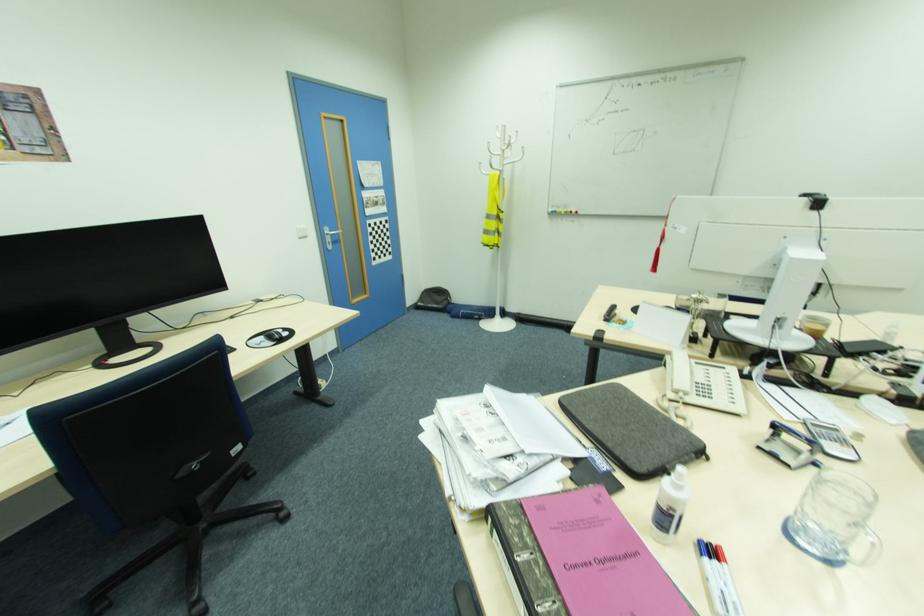
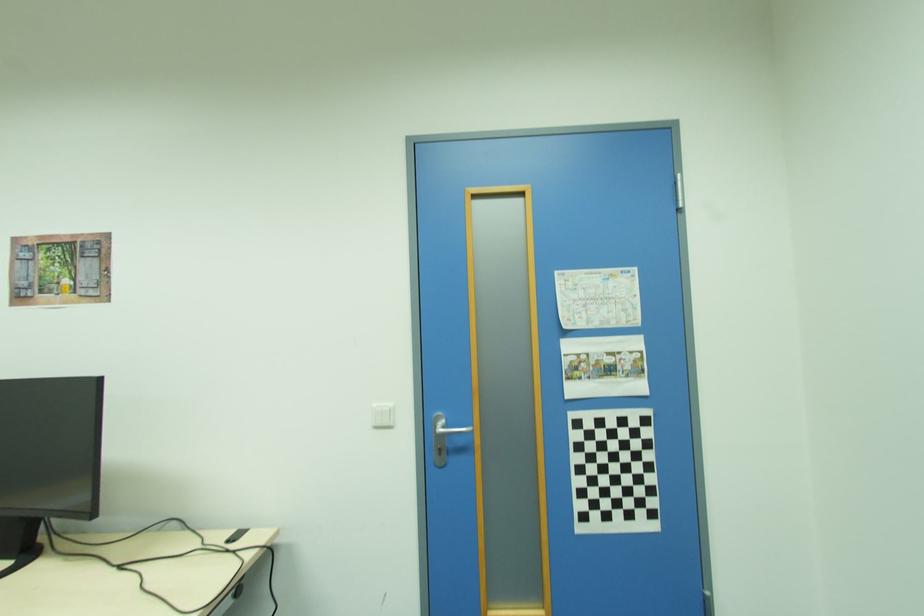
Find the pixel in the second image that matches point 371,203 in the first image.

(579, 369)